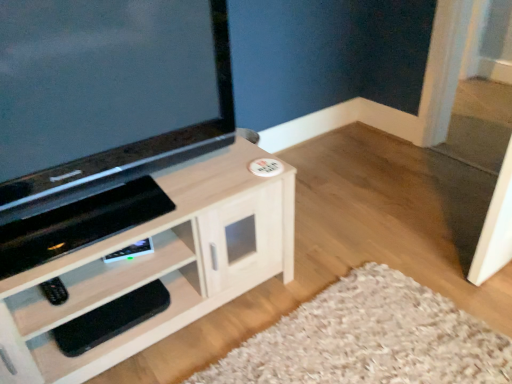
Locate an element on the screen. Image resolution: width=512 pixels, height=384 pixels. free space to the right of light wood cabinet at center is located at coordinates coord(331,295).